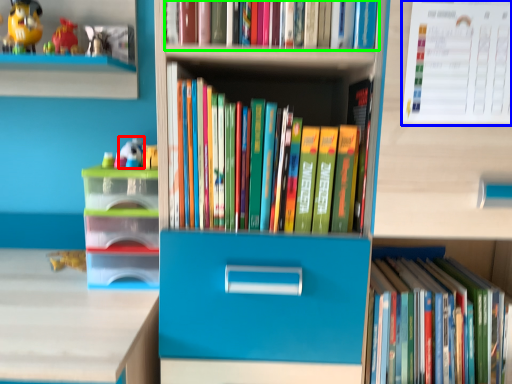
Question: Which object is the closest to the toy (highlighted by a red box)? Choose among these: paperback book (highlighted by a blue box) or book (highlighted by a green box).

Choices:
 (A) paperback book
 (B) book

Answer: (B)